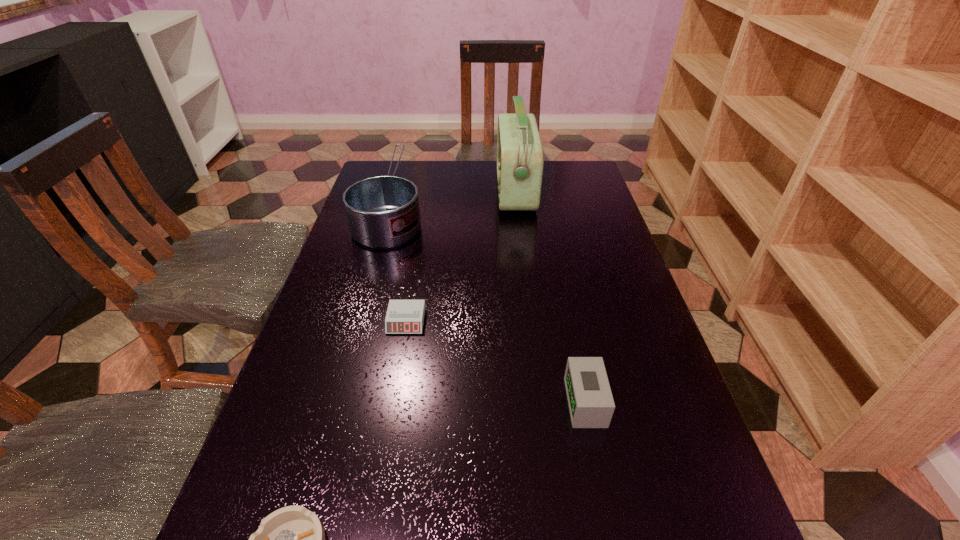
The height and width of the screenshot is (540, 960). In the image, there is a desktop. What are the coordinates of `vacant space at the right edge` in the screenshot? It's located at (595, 279).

Image resolution: width=960 pixels, height=540 pixels. In order to click on vacant position at the far left corner of the desktop in this screenshot , I will do `click(396, 167)`.

The image size is (960, 540). Find the location of `vacant area at the far right corner`. vacant area at the far right corner is located at coordinates (556, 191).

At what (x,y) coordinates should I click in order to perform the action: click on vacant space that's between the left alarm clock and the radio receiver. Please return your answer as a coordinate pair (x, y). The height and width of the screenshot is (540, 960). Looking at the image, I should click on (461, 256).

You are a GUI agent. You are given a task and a screenshot of the screen. Output one action in this format:
    pyautogui.click(x=<x>, y=<y>)
    Task: Click on the free area in between the tallest object and the third nearest object
    The width and height of the screenshot is (960, 540).
    Given the screenshot: What is the action you would take?
    pyautogui.click(x=461, y=256)

Find the location of `vacant area between the right alarm clock and the third nearest object`. vacant area between the right alarm clock and the third nearest object is located at coordinates (496, 362).

In order to click on vacant space in between the saucepan and the left alarm clock in this screenshot , I will do `click(399, 262)`.

Where is `blank region between the shorter alarm clock and the fourth shortest object`? Image resolution: width=960 pixels, height=540 pixels. blank region between the shorter alarm clock and the fourth shortest object is located at coordinates (399, 262).

Locate an element on the screen. Image resolution: width=960 pixels, height=540 pixels. free point between the saucepan and the right alarm clock is located at coordinates (490, 303).

Identify the location of vacant area that lies between the taller alarm clock and the third farthest object. Image resolution: width=960 pixels, height=540 pixels. (496, 362).